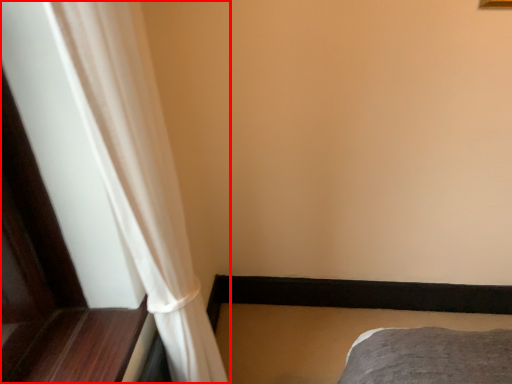
Question: From the image's perspective, what is the correct spatial relationship of curtain (annotated by the red box) in relation to bed frame?

Choices:
 (A) above
 (B) below

Answer: (A)